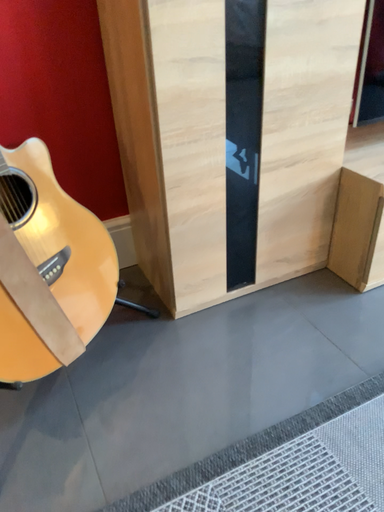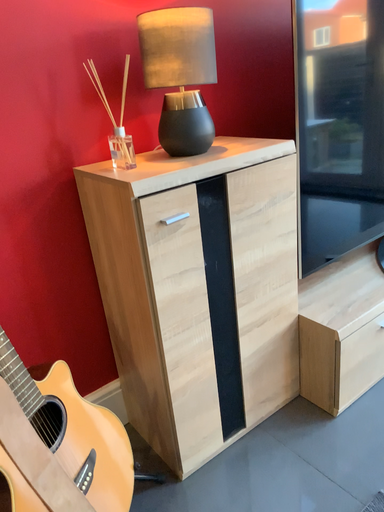
Question: Which way did the camera rotate in the video?

Choices:
 (A) rotated upward
 (B) rotated downward

Answer: (A)